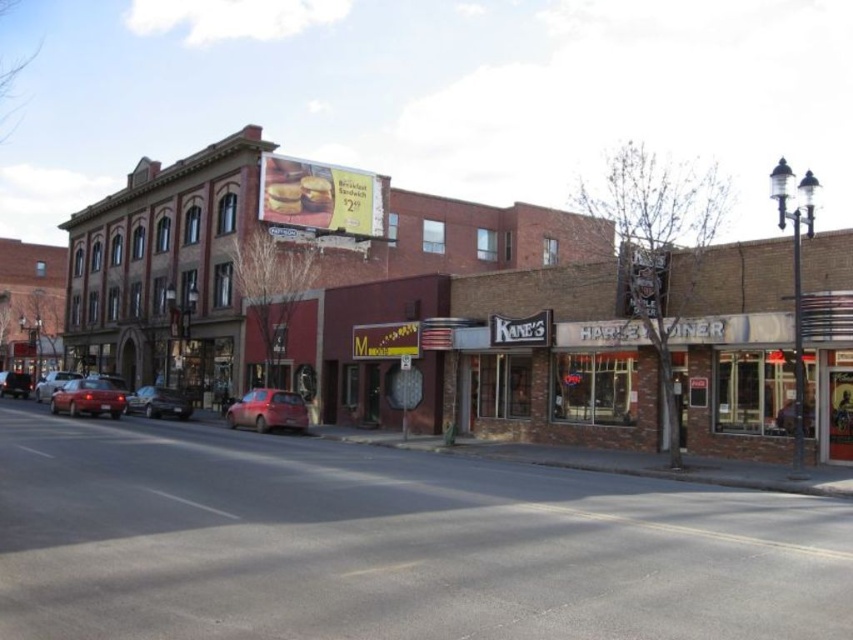
Measure the distance from matte silver sedan at left to matte red car at center.

They are 22.50 feet apart.

Can you confirm if matte silver sedan at left is positioned to the right of matte red car at center?

Indeed, matte silver sedan at left is positioned on the right side of matte red car at center.

Describe the element at coordinates (51, 384) in the screenshot. The height and width of the screenshot is (640, 853). I see `matte silver sedan at left` at that location.

Locate an element on the screen. This screenshot has height=640, width=853. matte silver sedan at left is located at coordinates (51, 384).

Find the location of `brick facade diner at center`. brick facade diner at center is located at coordinates (555, 385).

Between brick facade diner at center and matte red sedan at lower left, which one is positioned lower?

matte red sedan at lower left is below.

Between point (814, 356) and point (57, 392), which one is positioned behind?

The point (57, 392) is behind.

The height and width of the screenshot is (640, 853). I want to click on brick facade diner at center, so click(555, 385).

Can you confirm if brick building at center is positioned below matte red car at center?

No.

Who is positioned more to the left, brick building at center or matte red car at center?

From the viewer's perspective, matte red car at center appears more on the left side.

Who is more distant from viewer, [805,301] or [18,385]?

Point [18,385]

Locate an element on the screen. brick building at center is located at coordinates (432, 314).